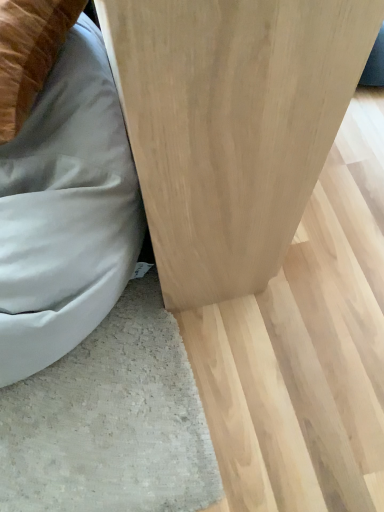
Question: From the image's perspective, is natural wood table at center below light gray fabric bean bag at lower left?

Choices:
 (A) yes
 (B) no

Answer: (B)

Question: Is natural wood table at center closer to the viewer compared to light gray fabric bean bag at lower left?

Choices:
 (A) no
 (B) yes

Answer: (B)

Question: Could you tell me if natural wood table at center is facing light gray fabric bean bag at lower left?

Choices:
 (A) yes
 (B) no

Answer: (B)

Question: Does natural wood table at center have a greater height compared to light gray fabric bean bag at lower left?

Choices:
 (A) yes
 (B) no

Answer: (A)

Question: Is natural wood table at center shorter than light gray fabric bean bag at lower left?

Choices:
 (A) no
 (B) yes

Answer: (A)

Question: Does natural wood table at center contain light gray fabric bean bag at lower left?

Choices:
 (A) yes
 (B) no

Answer: (B)

Question: From the image's perspective, does light gray fabric bean bag at lower left appear lower than natural wood table at center?

Choices:
 (A) no
 (B) yes

Answer: (B)

Question: Considering the relative sizes of light gray fabric bean bag at lower left and natural wood table at center in the image provided, is light gray fabric bean bag at lower left taller than natural wood table at center?

Choices:
 (A) yes
 (B) no

Answer: (B)

Question: Can you confirm if light gray fabric bean bag at lower left is thinner than natural wood table at center?

Choices:
 (A) no
 (B) yes

Answer: (B)

Question: Is light gray fabric bean bag at lower left further to camera compared to natural wood table at center?

Choices:
 (A) yes
 (B) no

Answer: (A)

Question: Could you tell me if light gray fabric bean bag at lower left is facing natural wood table at center?

Choices:
 (A) no
 (B) yes

Answer: (A)

Question: Considering the relative sizes of light gray fabric bean bag at lower left and natural wood table at center in the image provided, is light gray fabric bean bag at lower left shorter than natural wood table at center?

Choices:
 (A) no
 (B) yes

Answer: (B)

Question: Is natural wood table at center bigger or smaller than light gray fabric bean bag at lower left?

Choices:
 (A) small
 (B) big

Answer: (B)